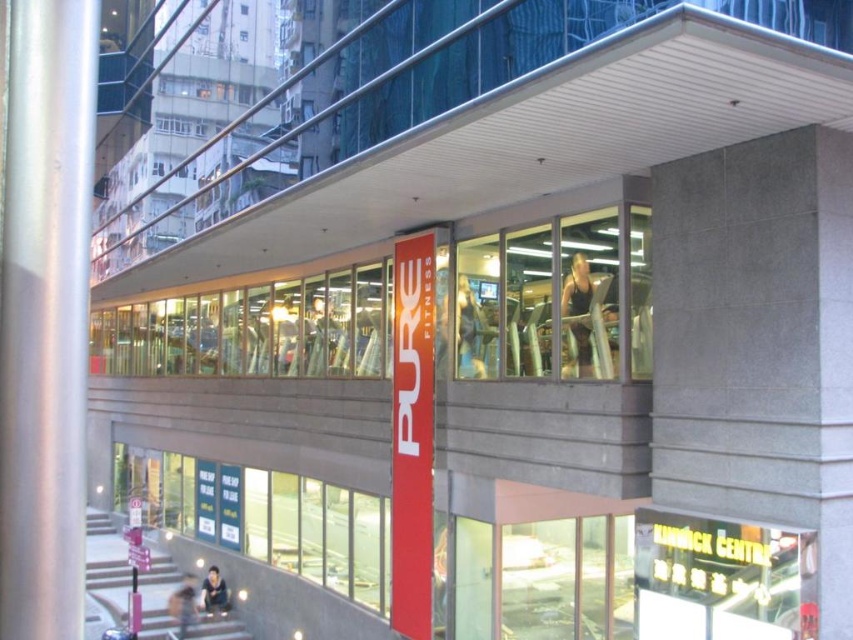
Question: Can you confirm if black matte tank top at center is positioned to the left of dark blue fabric shirt at lower center?

Choices:
 (A) yes
 (B) no

Answer: (B)

Question: Based on their relative distances, which object is nearer to the dark blue fabric shirt at lower center?

Choices:
 (A) silver metallic pole at left
 (B) black matte tank top at center
 (C) matte black treadmill at center

Answer: (C)

Question: Does black matte tank top at center appear on the left side of dark gray fabric pants at lower center?

Choices:
 (A) yes
 (B) no

Answer: (B)

Question: Which object appears closest to the camera in this image?

Choices:
 (A) dark gray fabric pants at lower center
 (B) dark blue fabric shirt at lower center
 (C) silver metallic pole at left
 (D) matte black treadmill at center

Answer: (C)

Question: Which point is closer to the camera?

Choices:
 (A) silver metallic pole at left
 (B) dark gray fabric pants at lower center

Answer: (A)

Question: From the image, what is the correct spatial relationship of black matte tank top at center in relation to matte black treadmill at center?

Choices:
 (A) above
 (B) below

Answer: (A)